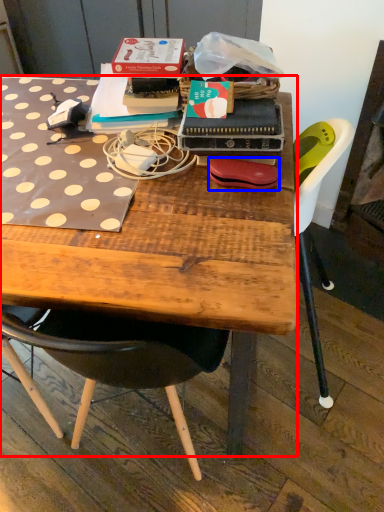
Question: Which object appears farthest to the camera in this image, desk (highlighted by a red box) or handbag (highlighted by a blue box)?

Choices:
 (A) desk
 (B) handbag

Answer: (B)